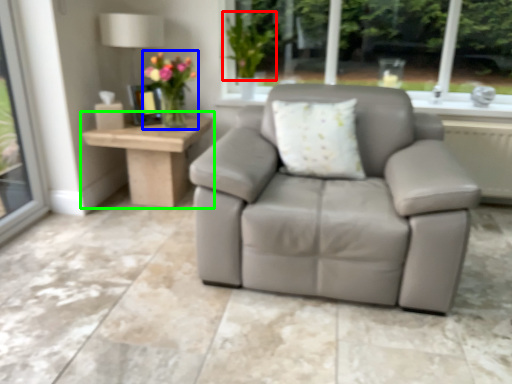
Question: Which object is the closest to the plant (highlighted by a red box)? Choose among these: floral arrangement (highlighted by a blue box) or table (highlighted by a green box).

Choices:
 (A) floral arrangement
 (B) table

Answer: (A)